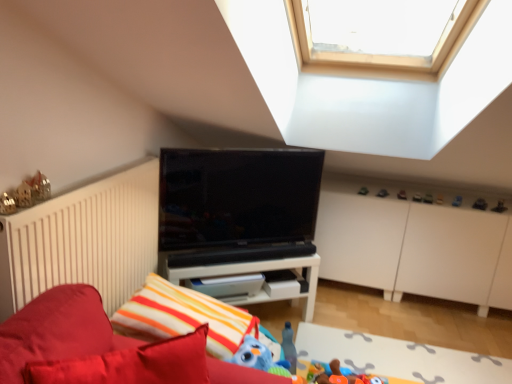
The width and height of the screenshot is (512, 384). What are the coordinates of `free spot to the right of matte black toy car at upper right, the fourth toy when ordered from left to right` in the screenshot? It's located at (403, 192).